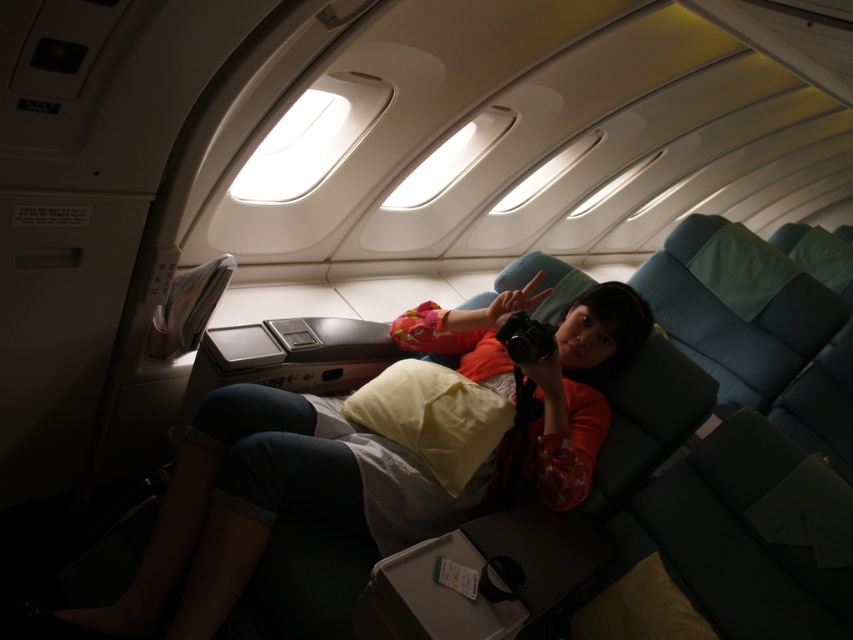
Between matte orange shirt at center and yellow soft pillow at center, which one is positioned lower?

matte orange shirt at center

Which of these two, matte orange shirt at center or yellow soft pillow at center, stands shorter?

yellow soft pillow at center is shorter.

Does point (421, 497) come in front of point (403, 381)?

Yes, it is.

At what (x,y) coordinates should I click in order to perform the action: click on matte orange shirt at center. Please return your answer as a coordinate pair (x, y). The image size is (853, 640). Looking at the image, I should click on (x=354, y=472).